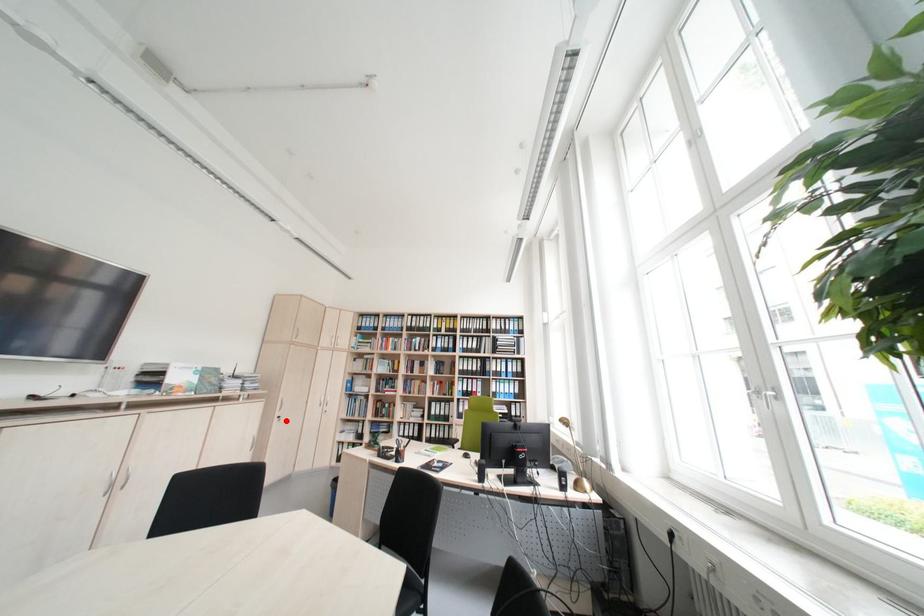
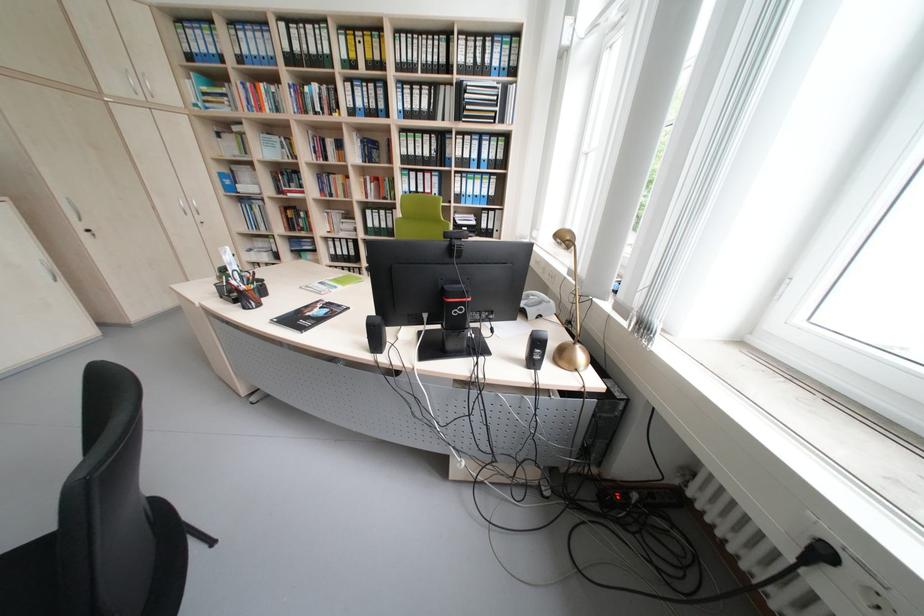
In the second image, find the point that corresponds to the highlighted location in the first image.

(93, 236)